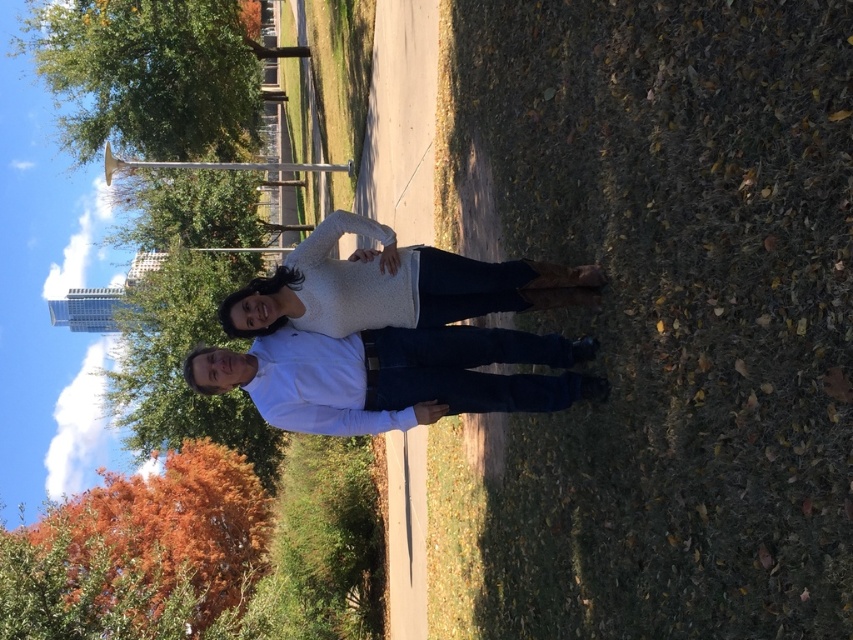
You are standing in the park and want to take a photo of both point [401,355] and point [387,284] in the scene. Which point should you focus on first to ensure both are in sharp focus?

You should focus on point [401,355] first because it is closer to the camera than point [387,284]. This ensures the closer point is in focus, and the farther point will also be within the depth of field.

In the scene shown: You are taking a photo of two people standing on a park path during autumn. You notice the white cotton shirt at center and the white knit sweater at center. Which clothing item appears smaller in the photo?

The white cotton shirt at center appears smaller than the white knit sweater at center in the photo.